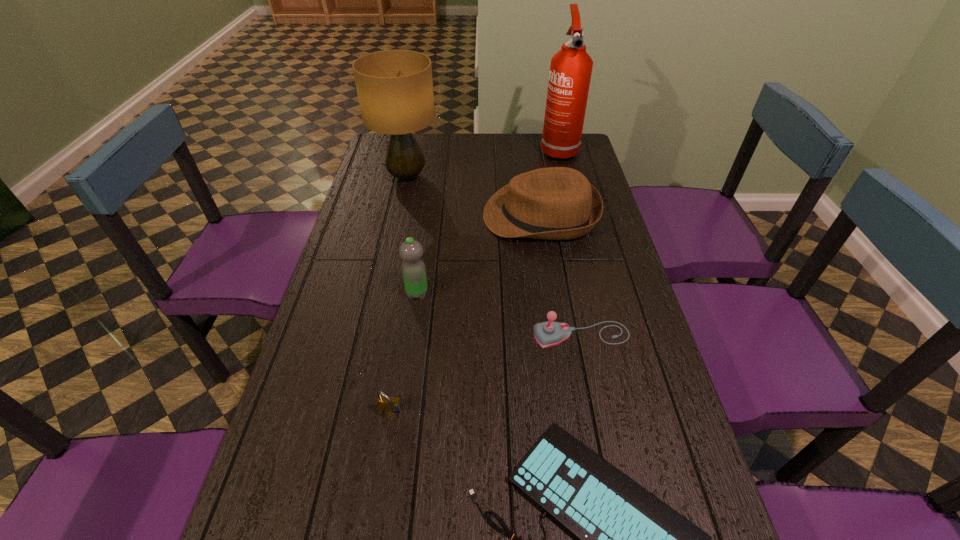
The image size is (960, 540). Identify the location of free point between the second tallest object and the padlock. (399, 294).

I want to click on blank region between the fifth farthest object and the fire extinguisher, so click(569, 242).

Identify which object is the third nearest to the tallest object. Please provide its 2D coordinates. Your answer should be formatted as a tuple, i.e. [(x, y)], where the tuple contains the x and y coordinates of a point satisfying the conditions above.

[(413, 269)]

This screenshot has height=540, width=960. What are the coordinates of `object that is the closest to the computer keyboard` in the screenshot? It's located at (386, 403).

Where is `vacant space that satisfies the following two spatial constraints: 1. on the front side of the lampshade; 2. on the right side of the fifth farthest object`? Image resolution: width=960 pixels, height=540 pixels. vacant space that satisfies the following two spatial constraints: 1. on the front side of the lampshade; 2. on the right side of the fifth farthest object is located at coordinates (372, 335).

Locate an element on the screen. vacant region that satisfies the following two spatial constraints: 1. on the front-facing side of the fedora; 2. on the side with the combination dials of the second nearest object is located at coordinates (572, 413).

Image resolution: width=960 pixels, height=540 pixels. Find the location of `vacant space that satisfies the following two spatial constraints: 1. on the front side of the lampshade; 2. on the left side of the joystick`. vacant space that satisfies the following two spatial constraints: 1. on the front side of the lampshade; 2. on the left side of the joystick is located at coordinates (372, 335).